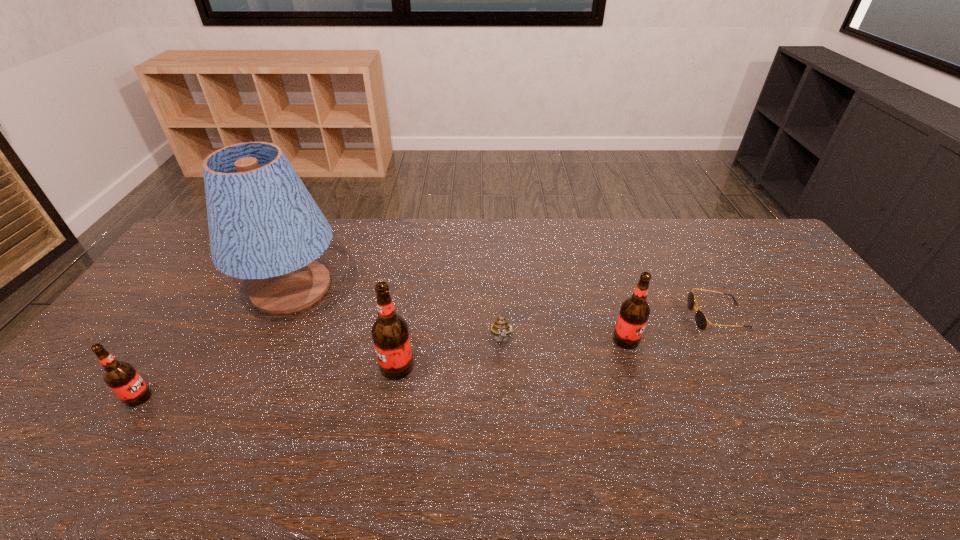
The image size is (960, 540). I want to click on vacant space that is in between the fifth object from left to right and the second object from left to right, so tap(459, 314).

Where is `vacant area that lies between the leftmost root beer and the fourth object from right to left`? The image size is (960, 540). vacant area that lies between the leftmost root beer and the fourth object from right to left is located at coordinates (268, 382).

At what (x,y) coordinates should I click in order to perform the action: click on vacant region between the nearest object and the tallest root beer. Please return your answer as a coordinate pair (x, y). Looking at the image, I should click on (268, 382).

The width and height of the screenshot is (960, 540). I want to click on vacant space that's between the fifth shortest object and the fourth object from left to right, so click(449, 354).

The height and width of the screenshot is (540, 960). Identify the location of object that ranks as the closest to the nearest object. (264, 225).

Point out which object is positioned as the second nearest to the second nearest root beer. Please provide its 2D coordinates. Your answer should be formatted as a tuple, i.e. [(x, y)], where the tuple contains the x and y coordinates of a point satisfying the conditions above.

[(500, 328)]

Image resolution: width=960 pixels, height=540 pixels. Identify the location of root beer that is the third closest one to the rightmost object. click(121, 377).

Choose which root beer is the second nearest neighbor to the second farthest root beer. Please provide its 2D coordinates. Your answer should be formatted as a tuple, i.e. [(x, y)], where the tuple contains the x and y coordinates of a point satisfying the conditions above.

[(121, 377)]